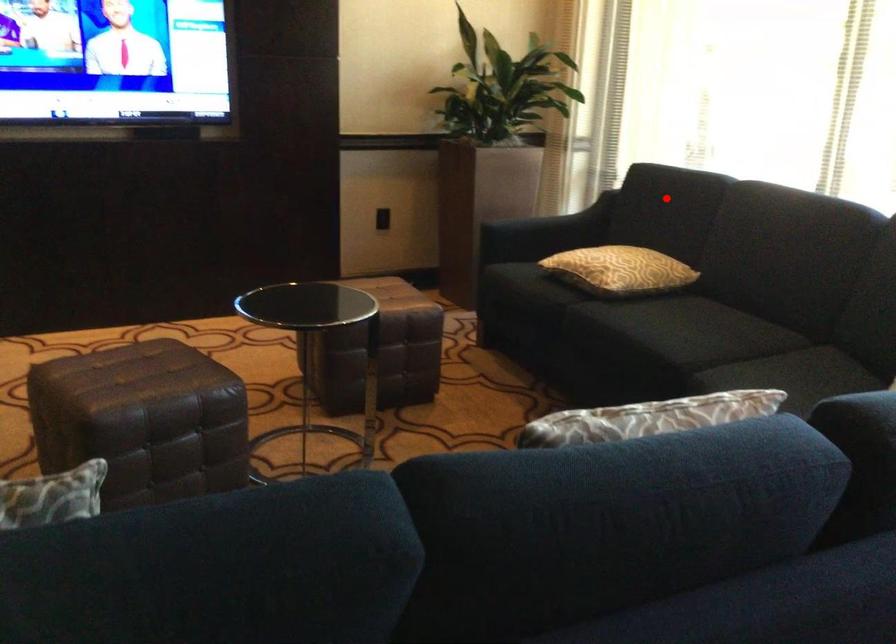
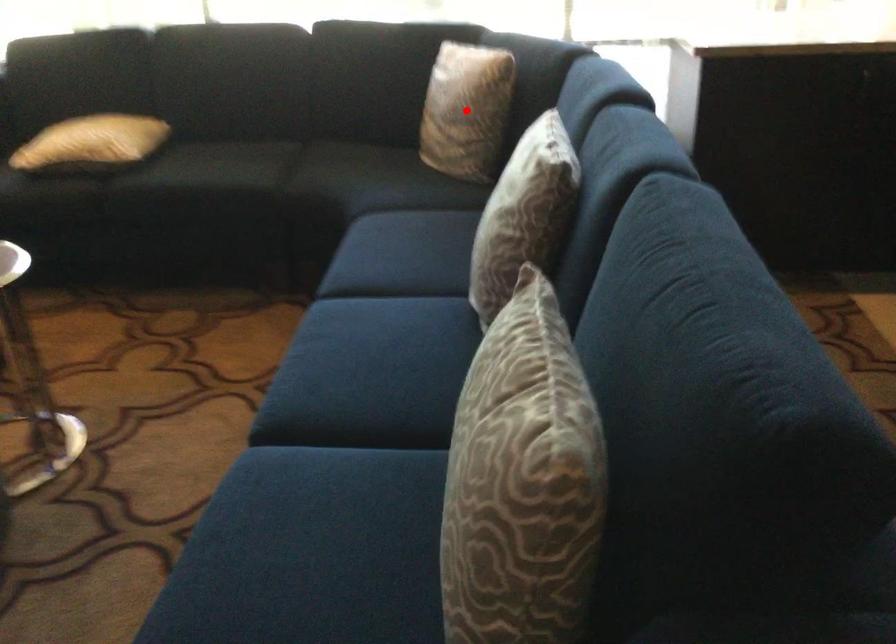
I am providing you with two images of the same scene from different viewpoints. A red point is marked on the first image and another point is marked on the second image. Does the point marked in image1 correspond to the same location as the one in image2?

No